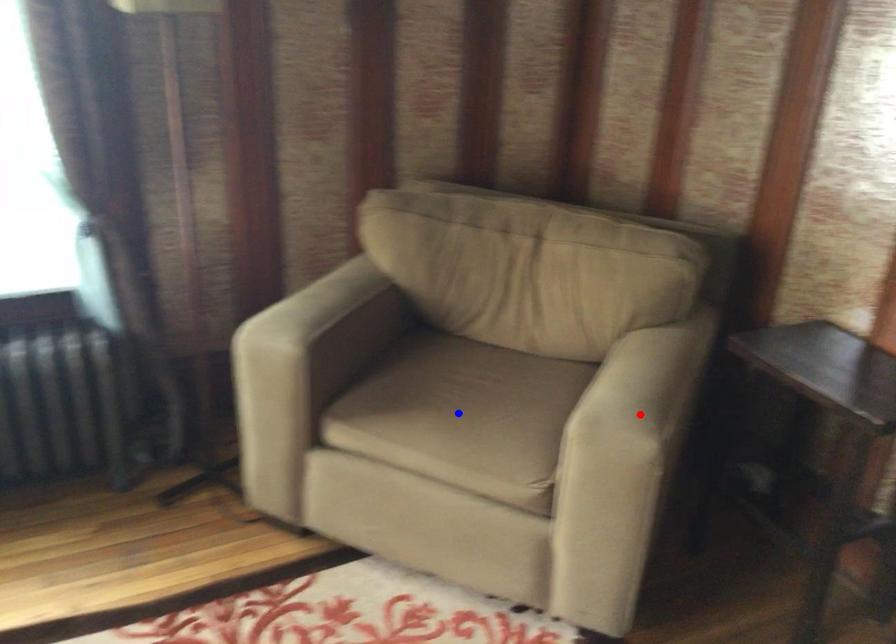
Question: In the image, two points are highlighted. Which point is nearer to the camera? Reply with the corresponding letter.

Choices:
 (A) blue point
 (B) red point

Answer: (B)